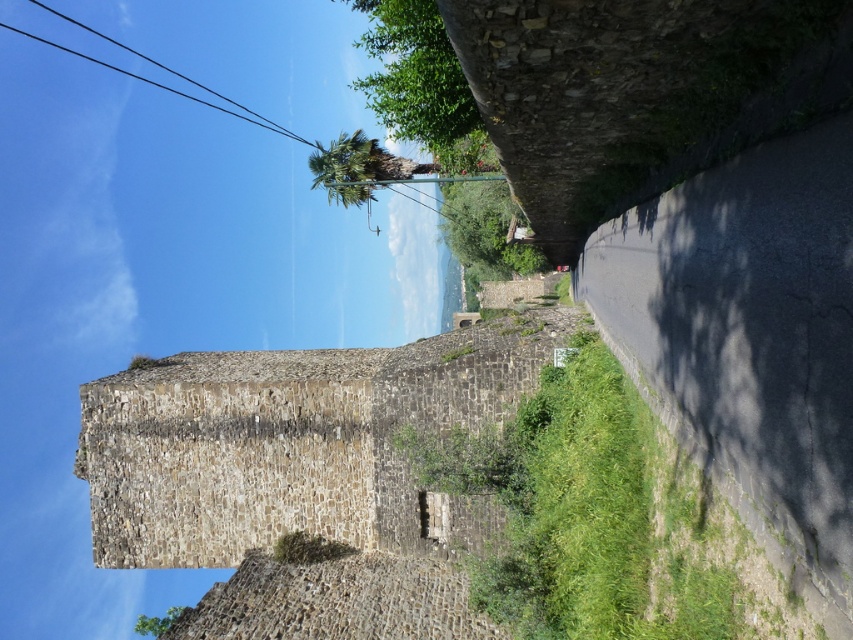
Question: Which object appears closest to the camera in this image?

Choices:
 (A) black wire at upper left
 (B) green leafy tree at lower left

Answer: (B)

Question: Which point appears closest to the camera in this image?

Choices:
 (A) (422, 33)
 (B) (165, 628)
 (C) (456, 228)

Answer: (A)

Question: Estimate the real-world distances between objects in this image. Which object is closer to the green leafy palm at upper center?

Choices:
 (A) black wire at upper left
 (B) green leafy tree at upper center
 (C) green leafy tree at lower left
 (D) green leafy tree at center

Answer: (B)

Question: Observing the image, what is the correct spatial positioning of green leafy tree at upper center in reference to black wire at upper left?

Choices:
 (A) left
 (B) right

Answer: (B)

Question: Can you confirm if green leafy tree at center is wider than black wire at upper left?

Choices:
 (A) yes
 (B) no

Answer: (B)

Question: Can you confirm if green leafy tree at center is positioned to the left of green leafy palm at upper center?

Choices:
 (A) yes
 (B) no

Answer: (B)